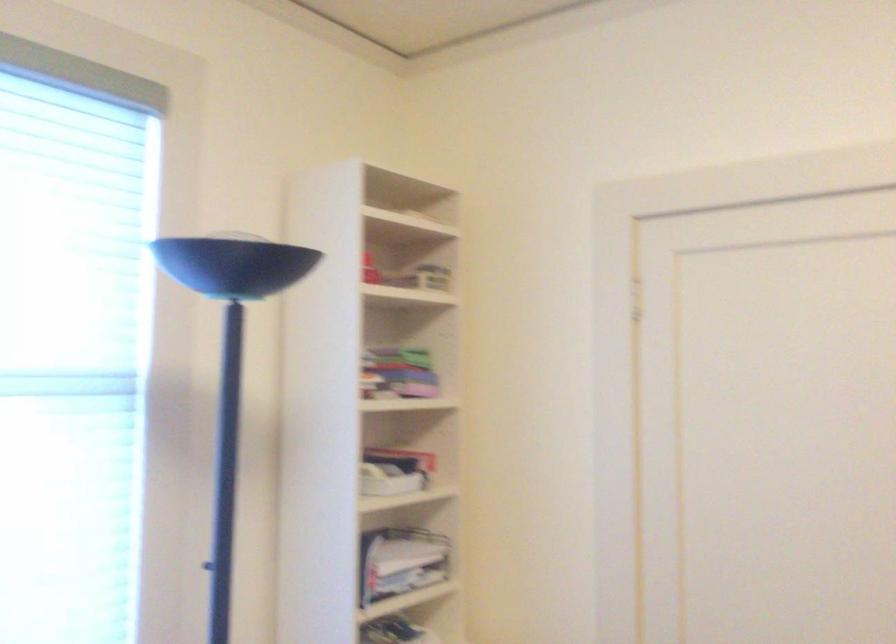
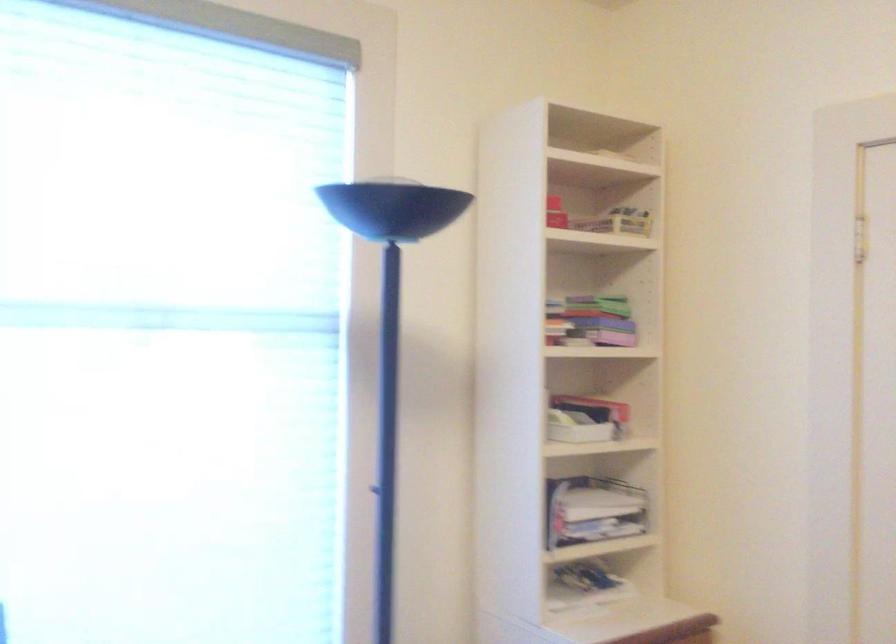
In the second image, find the point that corresponds to point (366, 266) in the first image.

(555, 213)